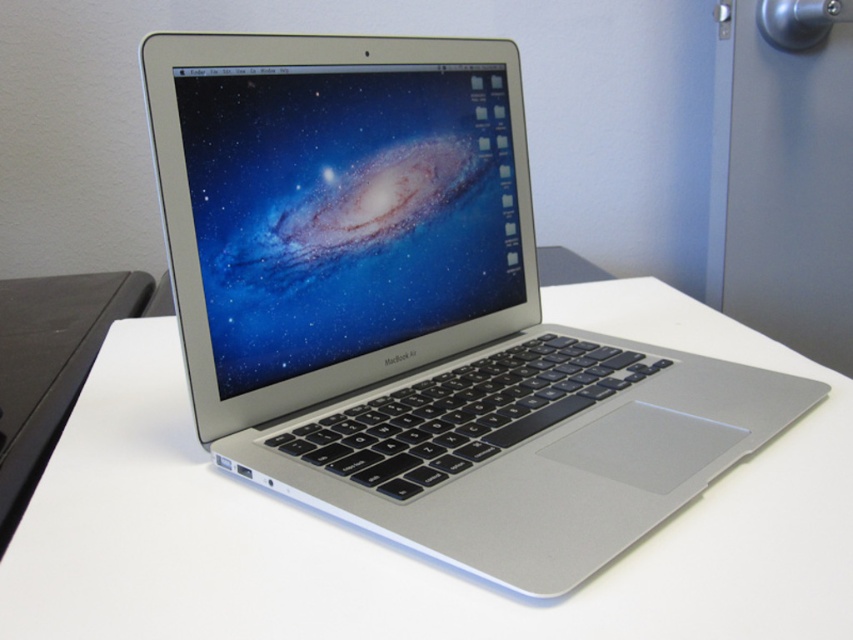
Question: Does silver metallic laptop at center have a greater width compared to white matte table at center?

Choices:
 (A) yes
 (B) no

Answer: (B)

Question: Does silver metallic laptop at center come behind white matte table at center?

Choices:
 (A) no
 (B) yes

Answer: (B)

Question: Which point is closer to the camera?

Choices:
 (A) silver metallic laptop at center
 (B) white matte table at center

Answer: (B)

Question: In this image, where is silver metallic laptop at center located relative to white matte table at center?

Choices:
 (A) below
 (B) above

Answer: (B)

Question: Which of the following is the closest to the observer?

Choices:
 (A) [x=125, y=445]
 (B) [x=170, y=179]

Answer: (B)